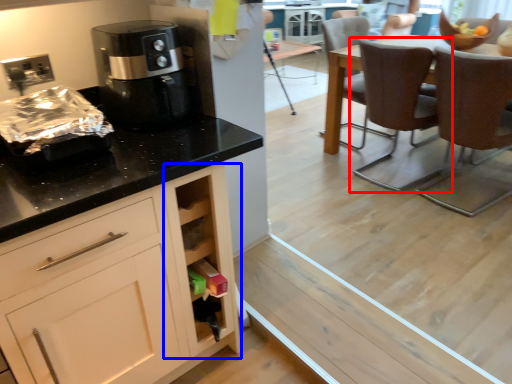
Question: Which object is further to the camera taking this photo, chair (highlighted by a red box) or cabinetry (highlighted by a blue box)?

Choices:
 (A) chair
 (B) cabinetry

Answer: (A)